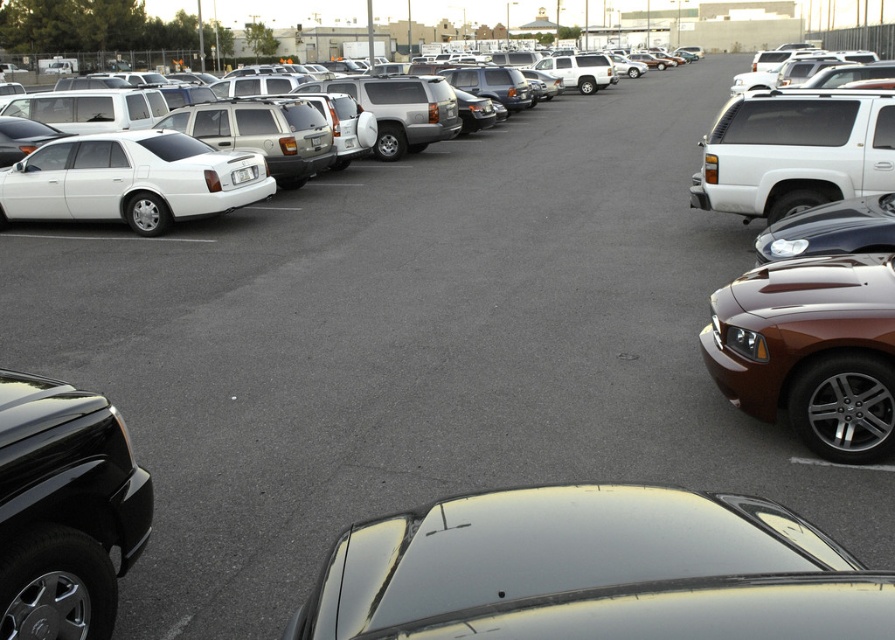
Question: Is glossy black car at center to the right of white glossy sedan at upper left from the viewer's perspective?

Choices:
 (A) yes
 (B) no

Answer: (B)

Question: Is black glossy sedan at lower left to the left of matte white sedan at left from the viewer's perspective?

Choices:
 (A) yes
 (B) no

Answer: (B)

Question: Can you confirm if glossy black car at center is positioned above matte white sedan at left?

Choices:
 (A) no
 (B) yes

Answer: (A)

Question: Which of the following is the closest to the observer?

Choices:
 (A) white glossy sedan at upper left
 (B) white matte suv at right
 (C) matte white sedan at left
 (D) black glossy sedan at lower left

Answer: (D)

Question: Based on their relative distances, which object is farther from the white glossy sedan at upper left?

Choices:
 (A) matte white sedan at left
 (B) glossy black car at center
 (C) white matte suv at right

Answer: (B)

Question: Considering the real-world distances, which object is closest to the white matte suv at right?

Choices:
 (A) matte white sedan at left
 (B) white glossy sedan at upper left
 (C) black glossy sedan at lower left

Answer: (A)